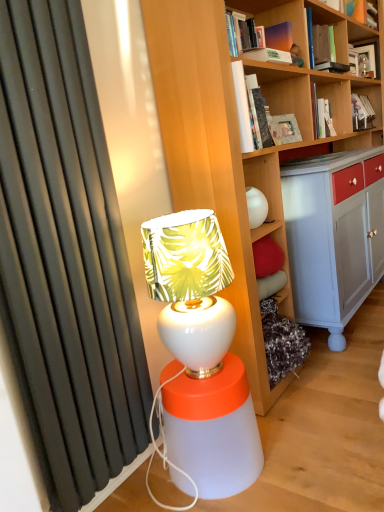
The image size is (384, 512). What do you see at coordinates (364, 59) in the screenshot?
I see `matte black frame at upper right, arranged as the second book when viewed from the top` at bounding box center [364, 59].

Image resolution: width=384 pixels, height=512 pixels. What do you see at coordinates (361, 112) in the screenshot?
I see `hardcover book at upper right, which appears as the 2th book when viewed from the back` at bounding box center [361, 112].

Image resolution: width=384 pixels, height=512 pixels. Describe the element at coordinates (356, 10) in the screenshot. I see `matte orange book at upper right, arranged as the fourth book when viewed from the front` at that location.

In order to click on matte black frame at upper right, which is counted as the 6th book, starting from the front in this screenshot , I will do `click(364, 59)`.

Is white glossy table lamp at center oriented towards hardcover book at upper right, marked as the fourth book in a top-to-bottom arrangement?

No, white glossy table lamp at center is not facing towards hardcover book at upper right, marked as the fourth book in a top-to-bottom arrangement.

What's the angular difference between white glossy table lamp at center and hardcover book at upper right, marked as the fourth book in a top-to-bottom arrangement,'s facing directions?

The angular difference between white glossy table lamp at center and hardcover book at upper right, marked as the fourth book in a top-to-bottom arrangement, is 0.000597 degrees.

Which of these two, white glossy table lamp at center or hardcover book at upper right, marked as the fourth book in a top-to-bottom arrangement, stands taller?

white glossy table lamp at center is taller.

In the scene shown: From the image's perspective, relative to hardcover book at upper right, which ranks as the fifth book in back-to-front order, is white glossy table lamp at center above or below?

Clearly, from the image's perspective, white glossy table lamp at center is below hardcover book at upper right, which ranks as the fifth book in back-to-front order.

From the image's perspective, does white glossy table lamp at center appear lower than matte orange book at upper right, arranged as the fourth book when viewed from the front?

Correct, white glossy table lamp at center appears lower than matte orange book at upper right, arranged as the fourth book when viewed from the front, in the image.

Is white glossy table lamp at center turned away from matte orange book at upper right, acting as the 6th book starting from the bottom?

white glossy table lamp at center does not have its back to matte orange book at upper right, acting as the 6th book starting from the bottom.

Consider the image. Is the position of white glossy table lamp at center less distant than that of matte orange book at upper right, which ranks as the third book in back-to-front order?

Yes, white glossy table lamp at center is in front of matte orange book at upper right, which ranks as the third book in back-to-front order.

Where is `book that is the 4th object located behind the white glossy table lamp at center`? book that is the 4th object located behind the white glossy table lamp at center is located at coordinates (356, 10).

Is hardcover book at upper center, which is counted as the 4th book, starting from the back, facing towards matte orange book at upper right, arranged as the fourth book when viewed from the front?

No, hardcover book at upper center, which is counted as the 4th book, starting from the back, is not aimed at matte orange book at upper right, arranged as the fourth book when viewed from the front.

How much distance is there between hardcover book at upper center, which is counted as the 4th book, starting from the back, and matte orange book at upper right, arranged as the fourth book when viewed from the front?

A distance of 30.50 inches exists between hardcover book at upper center, which is counted as the 4th book, starting from the back, and matte orange book at upper right, arranged as the fourth book when viewed from the front.

From the image's perspective, who appears lower, hardcover book at upper center, which is counted as the 4th book, starting from the back, or matte orange book at upper right, arranged as the fourth book when viewed from the front?

hardcover book at upper center, which is counted as the 4th book, starting from the back, appears lower in the image.

The height and width of the screenshot is (512, 384). In the image, there is a hardcover book at upper center, which is the 3th book from front to back. Find the location of `table lamp below it (from a real-world perspective)`. table lamp below it (from a real-world perspective) is located at coordinates (190, 287).

Does white glossy table lamp at center have a greater width compared to hardcover book at upper center, positioned as the 3th book in top-to-bottom order?

Yes.

Are white glossy table lamp at center and hardcover book at upper center, positioned as the 3th book in top-to-bottom order, located far from each other?

white glossy table lamp at center is positioned a significant distance from hardcover book at upper center, positioned as the 3th book in top-to-bottom order.

Between point (163, 283) and point (322, 53), which one is positioned in front?

The point (163, 283) is more forward.

What's the angular difference between hardcover book at upper center, which is the sixth book from top to bottom, and hardcover book at upper right, which is counted as the 3th book, starting from the bottom,'s facing directions?

The facing directions of hardcover book at upper center, which is the sixth book from top to bottom, and hardcover book at upper right, which is counted as the 3th book, starting from the bottom, are 29.2 degrees apart.

In terms of height, does hardcover book at upper center, which appears as the 1th book when ordered from the bottom, look taller or shorter compared to hardcover book at upper right, which is counted as the 3th book, starting from the bottom?

hardcover book at upper center, which appears as the 1th book when ordered from the bottom, is shorter than hardcover book at upper right, which is counted as the 3th book, starting from the bottom.

From a real-world perspective, who is located higher, hardcover book at upper center, which appears as the 1th book when ordered from the bottom, or hardcover book at upper right, which is counted as the 3th book, starting from the bottom?

In real-world perspective, hardcover book at upper right, which is counted as the 3th book, starting from the bottom, is above.

Is hardcover book at upper right, marked as the fourth book in a top-to-bottom arrangement, thinner than hardcover book at upper center, the sixth book positioned from the back?

Incorrect, the width of hardcover book at upper right, marked as the fourth book in a top-to-bottom arrangement, is not less than that of hardcover book at upper center, the sixth book positioned from the back.

From a real-world perspective, is hardcover book at upper right, acting as the 2th book starting from the front, physically below hardcover book at upper center, which appears as the 1th book when ordered from the bottom?

Incorrect, from a real-world perspective, hardcover book at upper right, acting as the 2th book starting from the front, is higher than hardcover book at upper center, which appears as the 1th book when ordered from the bottom.

From the image's perspective, who appears lower, hardcover book at upper right, acting as the 2th book starting from the front, or hardcover book at upper center, the 1th book when ordered from front to back?

hardcover book at upper center, the 1th book when ordered from front to back, from the image's perspective.

Which is closer to the camera, (x=331, y=42) or (x=298, y=137)?

The point (x=298, y=137) is closer to the camera.

How much distance is there between hardcover book at upper center, placed as the fourth book when sorted from bottom to top, and hardcover book at upper right, which ranks as the fifth book in back-to-front order?

The distance of hardcover book at upper center, placed as the fourth book when sorted from bottom to top, from hardcover book at upper right, which ranks as the fifth book in back-to-front order, is 1.40 centimeters.

Is hardcover book at upper center, which is counted as the 4th book, starting from the back, in contact with hardcover book at upper right, marked as the fourth book in a top-to-bottom arrangement?

Yes, hardcover book at upper center, which is counted as the 4th book, starting from the back, is touching hardcover book at upper right, marked as the fourth book in a top-to-bottom arrangement.

Does hardcover book at upper center, which is the 3th book from front to back, appear on the right side of hardcover book at upper right, marked as the fourth book in a top-to-bottom arrangement?

Correct, you'll find hardcover book at upper center, which is the 3th book from front to back, to the right of hardcover book at upper right, marked as the fourth book in a top-to-bottom arrangement.

Does point (323, 69) come behind point (325, 36)?

That is False.

At what (x,y) coordinates should I click in order to perform the action: click on table lamp below the hardcover book at upper right, acting as the 2th book starting from the front (from a real-world perspective). Please return your answer as a coordinate pair (x, y). Looking at the image, I should click on (190, 287).

Which book is the 4th one when counting from the right side of the white glossy table lamp at center? Please provide its 2D coordinates.

[(356, 10)]

Based on their spatial positions, is matte black frame at upper right, arranged as the second book when viewed from the top, or hardcover book at upper right, which appears as the 2th book when viewed from the back, closer to matte orange book at upper right, arranged as the fourth book when viewed from the front?

Based on the image, matte black frame at upper right, arranged as the second book when viewed from the top, appears to be nearer to matte orange book at upper right, arranged as the fourth book when viewed from the front.

Looking at the image, which one is located further to matte black frame at upper right, marked as the 1th book in a back-to-front arrangement, hardcover book at upper center, which is the sixth book from top to bottom, or hardcover book at upper right, which ranks as the fifth book in top-to-bottom order?

hardcover book at upper center, which is the sixth book from top to bottom, is positioned further to the anchor matte black frame at upper right, marked as the 1th book in a back-to-front arrangement.

Looking at the image, which one is located closer to matte orange book at upper right, the first book positioned from the top, hardcover book at upper center, the 1th book when ordered from front to back, or hardcover book at upper right, the second book ordered from the bottom?

hardcover book at upper right, the second book ordered from the bottom, lies closer to matte orange book at upper right, the first book positioned from the top, than the other object.

Considering their positions, is hardcover book at upper right, which ranks as the fifth book in back-to-front order, positioned further to hardcover book at upper right, the second book ordered from the bottom, than hardcover book at upper center, which appears as the 1th book when ordered from the bottom?

hardcover book at upper center, which appears as the 1th book when ordered from the bottom.

Based on their spatial positions, is matte black frame at upper right, which is counted as the 6th book, starting from the front, or hardcover book at upper right, marked as the fourth book in a top-to-bottom arrangement, closer to hardcover book at upper center, which is counted as the 4th book, starting from the back?

hardcover book at upper right, marked as the fourth book in a top-to-bottom arrangement, is positioned closer to the anchor hardcover book at upper center, which is counted as the 4th book, starting from the back.

From the image, which object appears to be farther from matte black frame at upper right, which is counted as the 6th book, starting from the front, matte orange book at upper right, arranged as the fourth book when viewed from the front, or white glossy table lamp at center?

white glossy table lamp at center is positioned further to the anchor matte black frame at upper right, which is counted as the 6th book, starting from the front.

From the image, which object appears to be farther from white glossy table lamp at center, hardcover book at upper center, the 1th book when ordered from front to back, or matte orange book at upper right, which ranks as the third book in back-to-front order?

matte orange book at upper right, which ranks as the third book in back-to-front order, is positioned further to the anchor white glossy table lamp at center.

Which object lies further to the anchor point hardcover book at upper right, marked as the fourth book in a top-to-bottom arrangement, white glossy table lamp at center or matte orange book at upper right, acting as the 6th book starting from the bottom?

white glossy table lamp at center is positioned further to the anchor hardcover book at upper right, marked as the fourth book in a top-to-bottom arrangement.

The image size is (384, 512). Identify the location of book between hardcover book at upper center, which is the 3th book from front to back, and hardcover book at upper right, the second book ordered from the bottom, in the front-back direction. (356, 10).